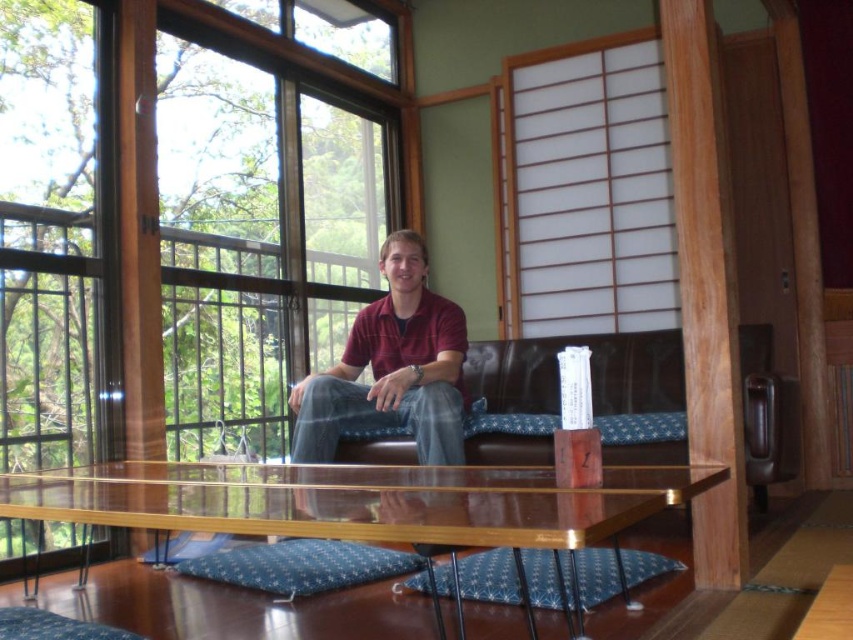
You are a delivery person who needs to place a heavy package on a surface that can support weight. The clear glass window at upper left and transparent glass table at center are in view. Which one is a better choice for placing the package?

The transparent glass table at center is a better choice for placing the heavy package because the clear glass window at upper left is likely not designed to support weight, while tables are typically built to hold items.

You are standing in the room and want to walk towards the two points marked in the image. Which point, point [206,396] or point [402,278], will you reach first?

You will reach point [206,396] first because it is closer to you than point [402,278], which is further away.

You are standing in the room and want to place a 3.5 feet long object on the transparent glass table at center. Can you determine if the object will fit on the table?

The transparent glass table at center and viewer are 3.59 feet apart, but this distance does not provide information about the table size. The question cannot be answered with the given information.